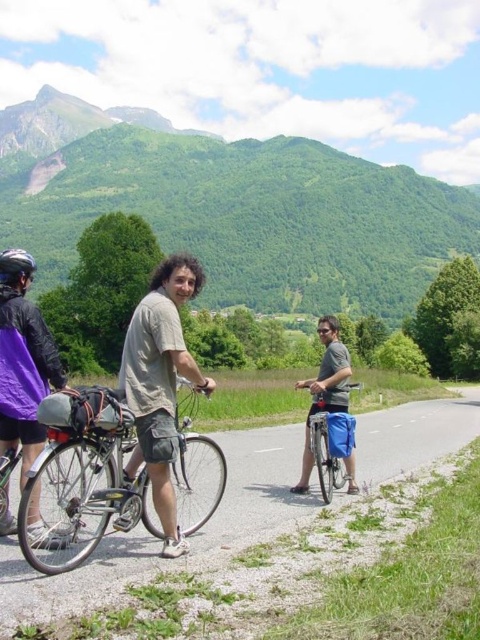
You are a photographer standing on the grassy verge to the right of the road. You want to take a photo of the metallic bicycle at center and the purple matte jacket at left. Which object should you focus on first if you want to capture both in the same frame without moving your camera?

The metallic bicycle at center is positioned under the purple matte jacket at left, so you should focus on the purple matte jacket at left first to ensure both are in the frame.

Consider the image. You are a hiker who wants to place a blue fabric bag at center exactly halfway between the green grassy mountain at upper center and the road. Is this possible? Please explain.

The distance between the green grassy mountain at upper center and the blue fabric bag at center is 322.10 meters. To place the bag halfway between the mountain and the road, the distance from the mountain to the road should be twice the distance from the bag to the mountain. However, without knowing the total distance from the mountain to the road, we cannot determine if placing the bag halfway is feasible.

You are a photographer positioned at the end of the road. You want to take a photo that includes both the light brown cotton shirt at center and the purple matte jacket at left. Which cyclist should you move closer to the right side of the road to ensure both are fully visible in your frame?

To ensure both the light brown cotton shirt at center and the purple matte jacket at left are fully visible in your frame, you should move the purple matte jacket at left closer to the right side of the road. Since the light brown cotton shirt at center is already to the left of the purple matte jacket at left, adjusting the purple matte jacket at left towards the right will help align them within the camera frame.